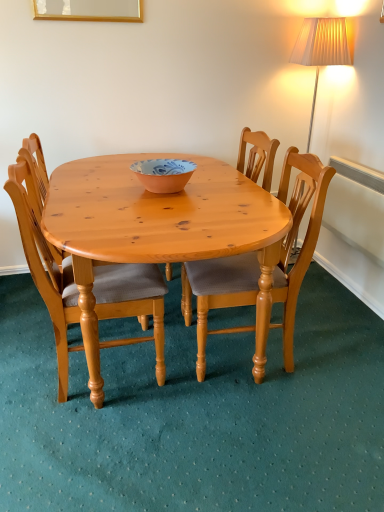
At what (x,y) coordinates should I click in order to perform the action: click on free spot in front of light brown wood chair at center, the 3th chair in the left-to-right sequence. Please return your answer as a coordinate pair (x, y). The height and width of the screenshot is (512, 384). Looking at the image, I should click on (262, 422).